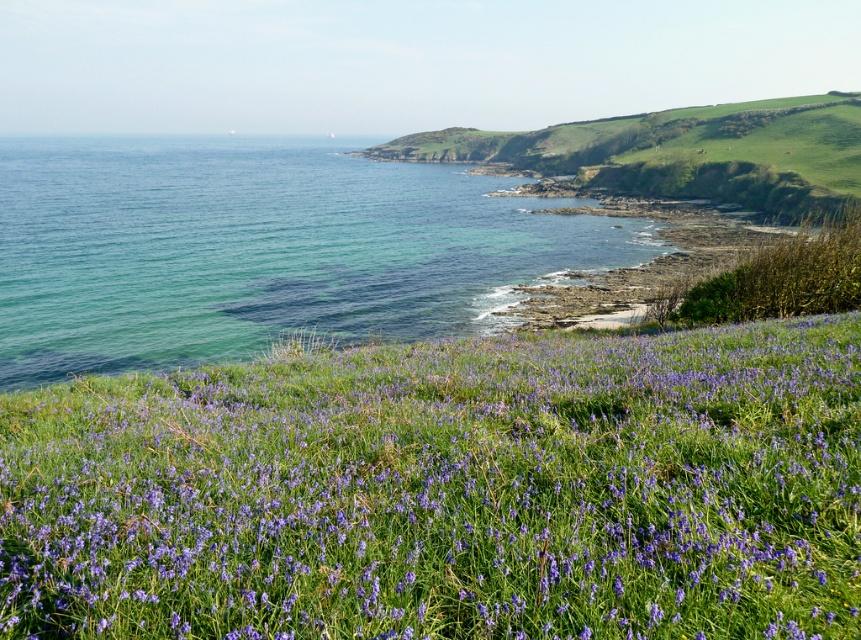
Based on the photo, can you confirm if purple grass at center is wider than clear blue water at left?

In fact, purple grass at center might be narrower than clear blue water at left.

Does purple grass at center appear over clear blue water at left?

No, purple grass at center is not above clear blue water at left.

Does point (77, 420) lie in front of point (50, 145)?

That is True.

Identify the location of purple grass at center. The width and height of the screenshot is (861, 640). (448, 492).